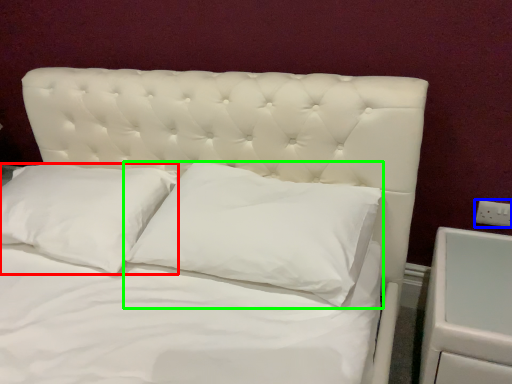
Question: Based on their relative distances, which object is farther from pillow (highlighted by a red box)? Choose from electric outlet (highlighted by a blue box) and pillow (highlighted by a green box).

Choices:
 (A) electric outlet
 (B) pillow

Answer: (A)